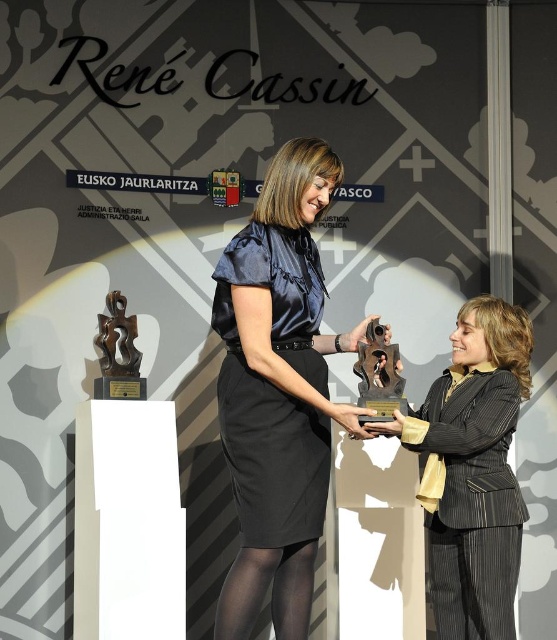
You are a photographer at the award ceremony and want to capture a closeup of the satin black dress at center. Based on its position, where should you aim your camera?

The satin black dress at center is located at the 2D coordinates point (278,392), so you should aim your camera at that point to capture a closeup.

You are a photographer at the award ceremony. You need to capture a photo where the satin black dress at center is clearly visible above the matte gold trophy at center. Is this possible based on the current arrangement?

Yes, because the satin black dress at center is already positioned above the matte gold trophy at center in the current arrangement.